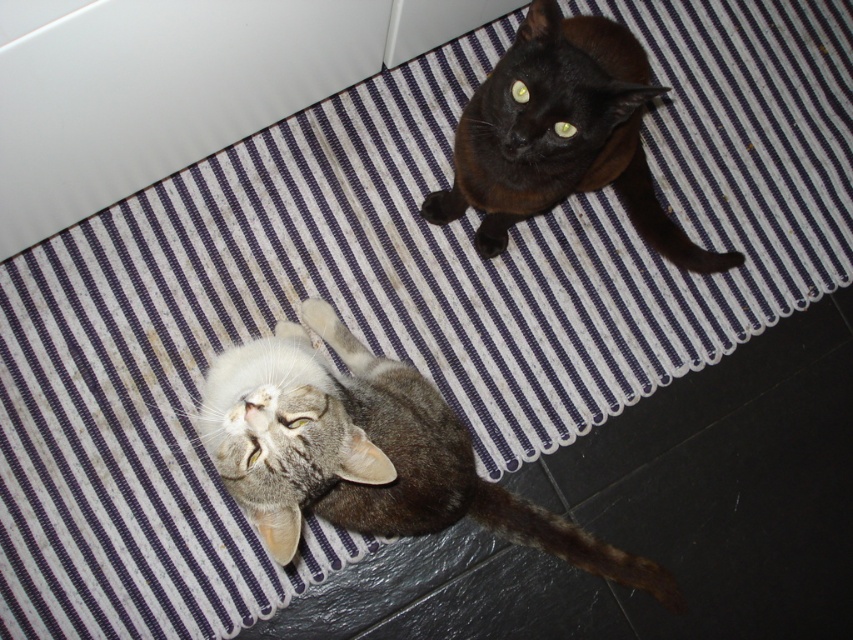
You are a photographer trying to capture both cats in a single shot. The gray tabby cat at lower left is represented by point (367, 452). Where should you position your camera to ensure both cats are in frame?

To capture both cats in frame, position the camera so that it includes the area around point (367, 452) where the gray tabby cat at lower left is located, ensuring the other cat is also within the camera view.

You are a photographer trying to capture both cats in a single shot. Since the gray tabby cat at lower left is closer to the viewer than the black glossy cat at upper center, which cat should you focus on to ensure both are in sharp focus?

To ensure both the gray tabty cat at lower left and the black glossy cat at upper center are in sharp focus, focus on the gray tabby cat at lower left since it is closer to the viewer.